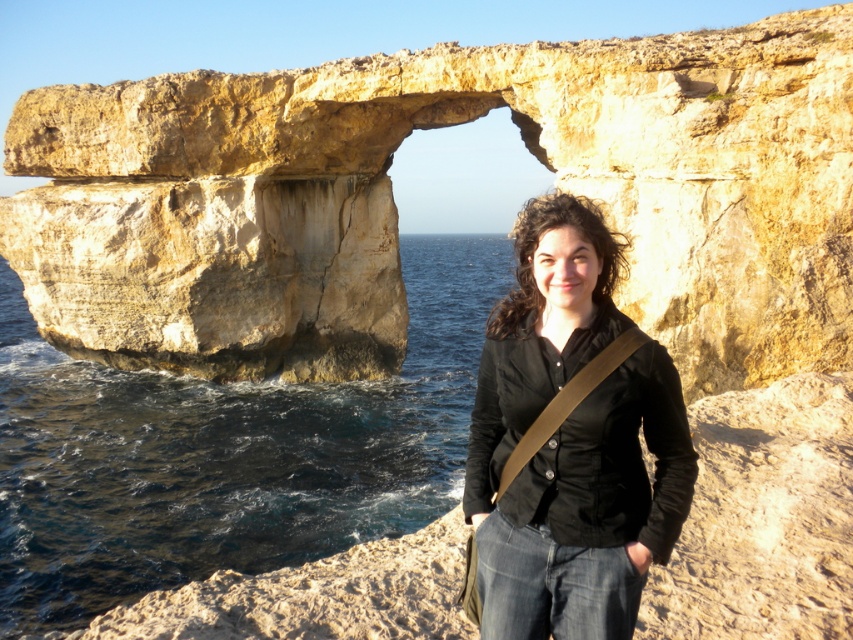
Question: Does dark blue water at lower left have a lesser width compared to smooth rock coast at lower center?

Choices:
 (A) yes
 (B) no

Answer: (B)

Question: Which object appears closest to the camera in this image?

Choices:
 (A) matte black shirt at center
 (B) dark blue water at lower left
 (C) smooth rock coast at lower center
 (D) yellowish stone arch at center

Answer: (A)

Question: Is yellowish stone arch at center bigger than matte black shirt at center?

Choices:
 (A) no
 (B) yes

Answer: (B)

Question: Which of these objects is positioned closest to the matte black shirt at center?

Choices:
 (A) dark blue water at lower left
 (B) smooth rock coast at lower center
 (C) yellowish stone arch at center

Answer: (B)

Question: Which is nearer to the matte black shirt at center?

Choices:
 (A) yellowish stone arch at center
 (B) dark blue water at lower left

Answer: (A)

Question: Can you confirm if dark blue water at lower left is bigger than matte black shirt at center?

Choices:
 (A) no
 (B) yes

Answer: (B)